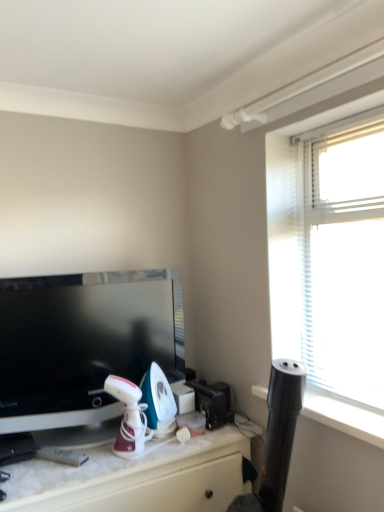
Where is `free space above white marble desk at lower center (from a real-world perspective)`? Image resolution: width=384 pixels, height=512 pixels. free space above white marble desk at lower center (from a real-world perspective) is located at coordinates (106, 446).